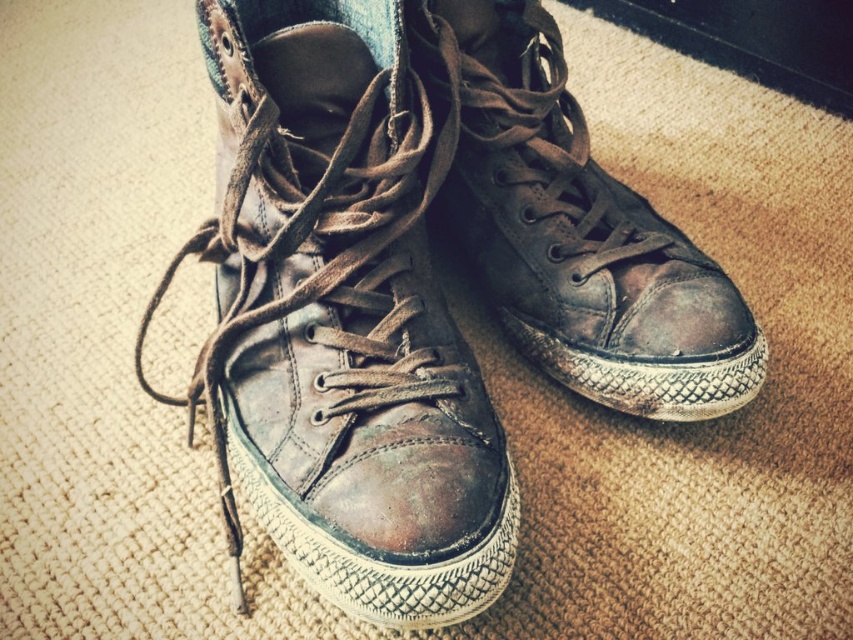
Is worn leather boot at center below leather high-top sneaker at center?

Correct, worn leather boot at center is located below leather high-top sneaker at center.

Describe the element at coordinates (341, 321) in the screenshot. I see `worn leather boot at center` at that location.

At what (x,y) coordinates should I click in order to perform the action: click on worn leather boot at center. Please return your answer as a coordinate pair (x, y). Looking at the image, I should click on (341, 321).